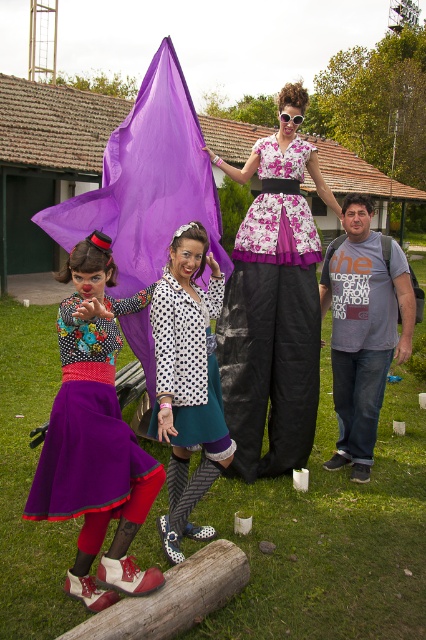
Question: Is gray cotton t-shirt at center thinner than brown wood log at lower center?

Choices:
 (A) yes
 (B) no

Answer: (A)

Question: Estimate the real-world distances between objects in this image. Which object is farther from the brown wood log at lower center?

Choices:
 (A) polka dot fabric dress at center
 (B) floral fabric dress at center
 (C) gray cotton t-shirt at center

Answer: (C)

Question: Does brown wood log at lower center come behind clear plastic goggles at center?

Choices:
 (A) yes
 (B) no

Answer: (B)

Question: Considering the real-world distances, which object is closest to the matte purple skirt at lower left?

Choices:
 (A) floral fabric dress at center
 (B) gray cotton t-shirt at center
 (C) clear plastic goggles at center

Answer: (A)

Question: Which of the following is the farthest from the observer?

Choices:
 (A) clear plastic goggles at center
 (B) floral fabric dress at center

Answer: (A)

Question: Is floral fabric dress at center thinner than matte purple skirt at lower left?

Choices:
 (A) yes
 (B) no

Answer: (B)